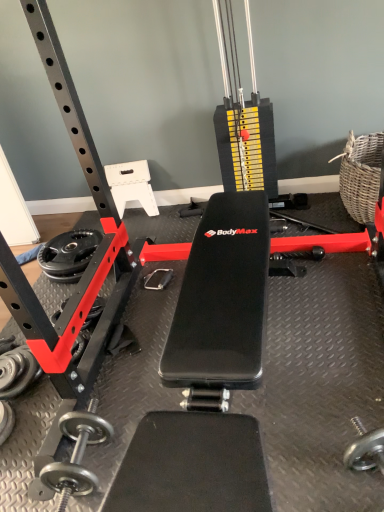
Question: Does woven natural basket at right turn towards silver metallic dumbbell at lower left, the second dumbbell in the top-to-bottom sequence?

Choices:
 (A) yes
 (B) no

Answer: (B)

Question: Is woven natural basket at right thinner than silver metallic dumbbell at lower left, the second dumbbell in the top-to-bottom sequence?

Choices:
 (A) no
 (B) yes

Answer: (A)

Question: Is woven natural basket at right at the right side of silver metallic dumbbell at lower left, the first dumbbell positioned from the bottom?

Choices:
 (A) no
 (B) yes

Answer: (B)

Question: Can you see woven natural basket at right touching silver metallic dumbbell at lower left, the first dumbbell positioned from the bottom?

Choices:
 (A) yes
 (B) no

Answer: (B)

Question: From the image's perspective, is woven natural basket at right above silver metallic dumbbell at lower left, the first dumbbell positioned from the bottom?

Choices:
 (A) no
 (B) yes

Answer: (B)

Question: From the image's perspective, is woven natural basket at right beneath silver metallic dumbbell at lower left, the first dumbbell positioned from the bottom?

Choices:
 (A) no
 (B) yes

Answer: (A)

Question: Is silver metallic dumbbell at lower left, the second dumbbell in the top-to-bottom sequence, far away from black rubber dumbbell at lower left, acting as the 1th dumbbell starting from the top?

Choices:
 (A) no
 (B) yes

Answer: (A)

Question: Can you confirm if silver metallic dumbbell at lower left, the second dumbbell in the top-to-bottom sequence, is taller than black rubber dumbbell at lower left, acting as the 1th dumbbell starting from the top?

Choices:
 (A) no
 (B) yes

Answer: (A)

Question: Does silver metallic dumbbell at lower left, the first dumbbell positioned from the bottom, come in front of black rubber dumbbell at lower left, acting as the 1th dumbbell starting from the top?

Choices:
 (A) yes
 (B) no

Answer: (A)

Question: Considering the relative sizes of silver metallic dumbbell at lower left, the first dumbbell positioned from the bottom, and black rubber dumbbell at lower left, which is the 2th dumbbell from bottom to top, in the image provided, is silver metallic dumbbell at lower left, the first dumbbell positioned from the bottom, thinner than black rubber dumbbell at lower left, which is the 2th dumbbell from bottom to top,?

Choices:
 (A) no
 (B) yes

Answer: (A)

Question: Is silver metallic dumbbell at lower left, the second dumbbell in the top-to-bottom sequence, shorter than black rubber dumbbell at lower left, which is the 2th dumbbell from bottom to top?

Choices:
 (A) no
 (B) yes

Answer: (B)

Question: Is silver metallic dumbbell at lower left, the first dumbbell positioned from the bottom, smaller than black rubber dumbbell at lower left, acting as the 1th dumbbell starting from the top?

Choices:
 (A) no
 (B) yes

Answer: (B)

Question: Is black rubber dumbbell at lower left, acting as the 1th dumbbell starting from the top, thinner than silver metallic dumbbell at lower left, the first dumbbell positioned from the bottom?

Choices:
 (A) yes
 (B) no

Answer: (A)